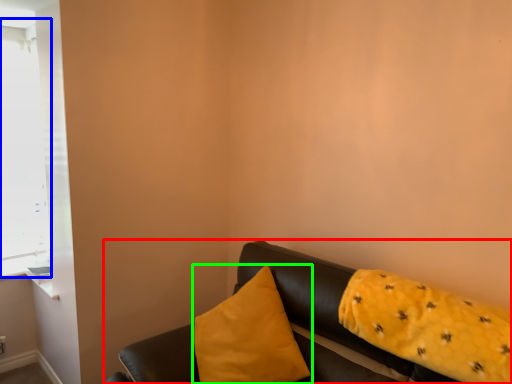
Question: Which is nearer to the studio couch (highlighted by a red box)? window (highlighted by a blue box) or pillow (highlighted by a green box).

Choices:
 (A) window
 (B) pillow

Answer: (B)